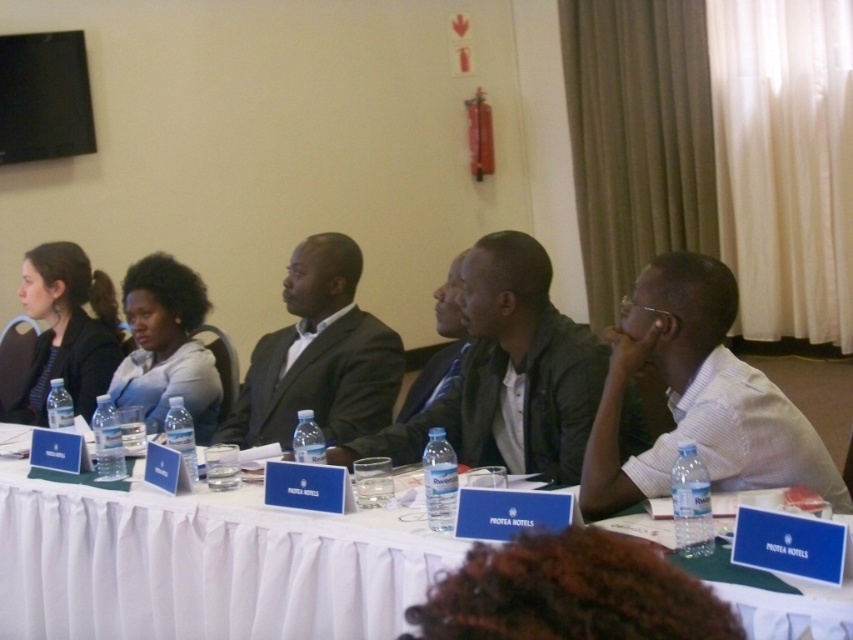
Does matte gray sweater at center have a greater width compared to matte black jacket at left?

In fact, matte gray sweater at center might be narrower than matte black jacket at left.

Which is more to the right, matte gray sweater at center or matte black jacket at left?

matte gray sweater at center

The image size is (853, 640). Find the location of `matte gray sweater at center`. matte gray sweater at center is located at coordinates (166, 346).

Who is positioned more to the right, dark gray leather jacket at center or matte black jacket at left?

dark gray leather jacket at center is more to the right.

Between dark gray leather jacket at center and matte black jacket at left, which one has less height?

dark gray leather jacket at center is shorter.

Describe the element at coordinates (508, 372) in the screenshot. Image resolution: width=853 pixels, height=640 pixels. I see `dark gray leather jacket at center` at that location.

Where is `dark gray leather jacket at center`? This screenshot has height=640, width=853. dark gray leather jacket at center is located at coordinates (508, 372).

Consider the image. Does black suit at center come behind matte gray sweater at center?

No, black suit at center is in front of matte gray sweater at center.

Can you confirm if black suit at center is positioned above matte gray sweater at center?

Correct, black suit at center is located above matte gray sweater at center.

Identify the location of black suit at center. (318, 355).